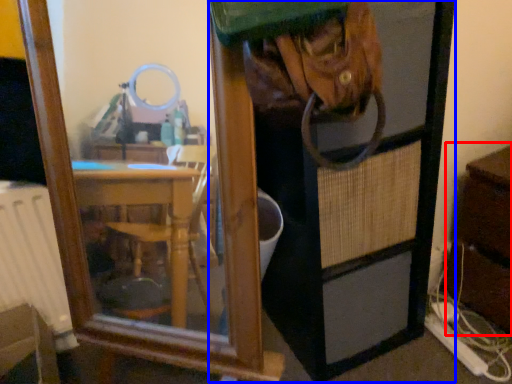
Question: Which point is further to the camera, dresser (highlighted by a red box) or screen door (highlighted by a blue box)?

Choices:
 (A) dresser
 (B) screen door

Answer: (A)